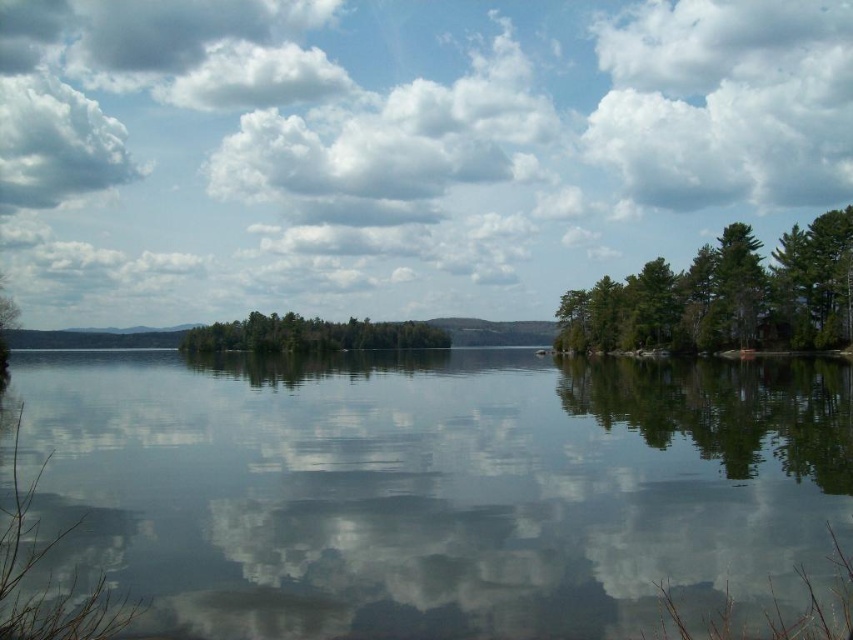
You are standing at the lakeside and want to determine the relative heights of the objects in the scene. Which object, the green matte tree at right or the cloudy sky at upper left, appears taller when viewed from your position?

The green matte tree at right has a lesser height compared to the cloudy sky at upper left, so the cloudy sky at upper left appears taller.

You are standing at the lakeside and looking towards the dense cluster of evergreen trees on the right. There is a point marked at coordinates [144,29] in the image. What can you see at that point?

At point [144,29], you can see cloudy sky at upper left.

You are standing at the lakeside and notice the green matte tree at right and the cloudy sky at upper left. Which one appears larger in the image?

The cloudy sky at upper left appears larger than the green matte tree at right in the image.